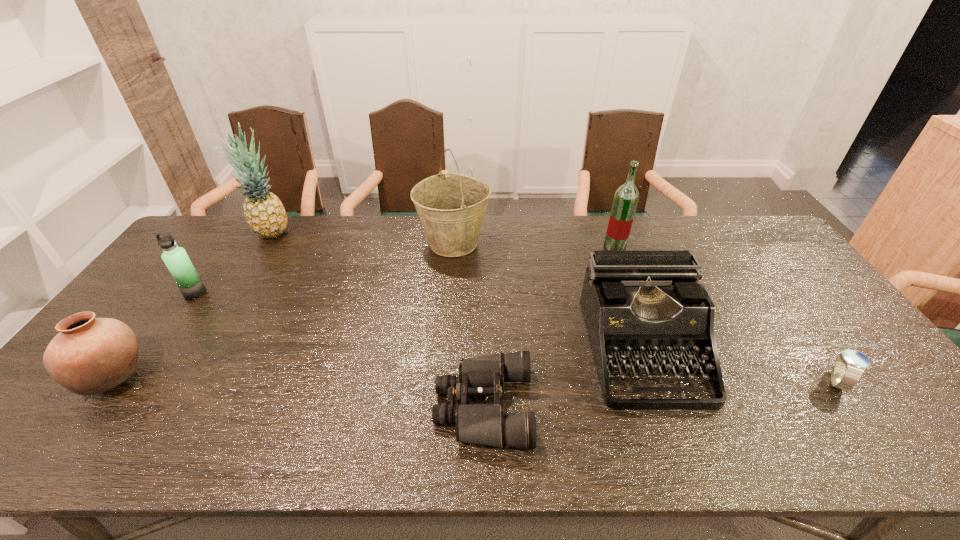
Locate an element on the screen. The image size is (960, 540). vacant space that satisfies the following two spatial constraints: 1. on the back side of the thermos bottle; 2. on the right side of the liquor is located at coordinates (228, 247).

At what (x,y) coordinates should I click in order to perform the action: click on vacant region that satisfies the following two spatial constraints: 1. on the back side of the pottery; 2. on the right side of the pineapple. Please return your answer as a coordinate pair (x, y). This screenshot has width=960, height=540. Looking at the image, I should click on (223, 233).